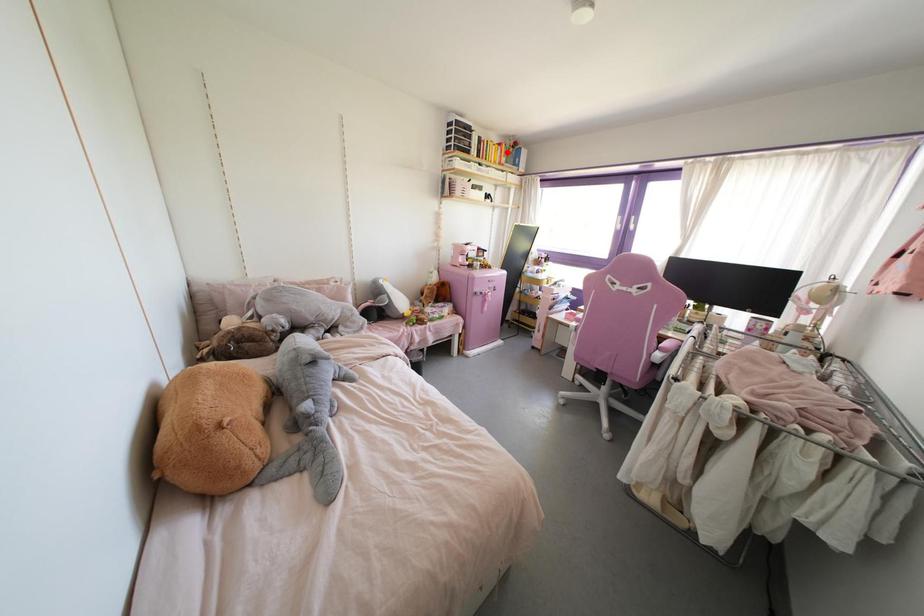
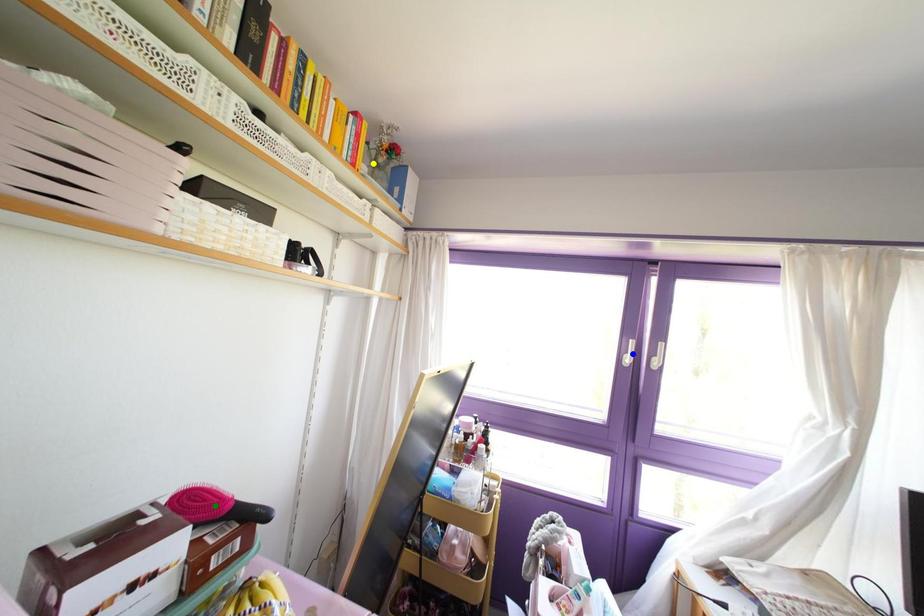
Question: I am providing you with two images of the same scene from different viewpoints. A red point is marked on the first image. You are given multiple points on the second image. Which spot in image 2 lines up with the point in image 1?

Choices:
 (A) blue point
 (B) yellow point
 (C) green point

Answer: (B)